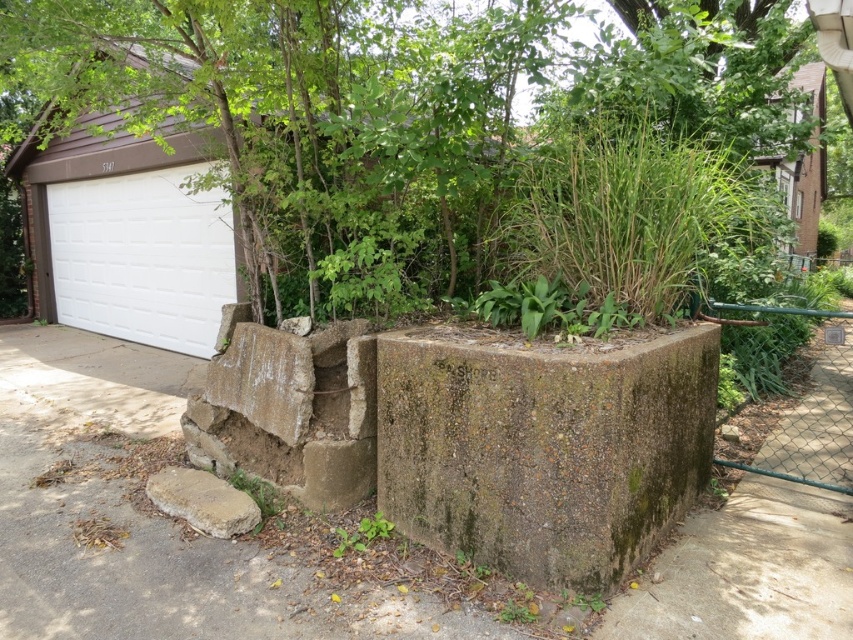
Is green chain-link fence at right taller than brown rough stone at lower left?

Incorrect, green chain-link fence at right's height is not larger of brown rough stone at lower left's.

Does green chain-link fence at right appear on the right side of brown rough stone at lower left?

Indeed, green chain-link fence at right is positioned on the right side of brown rough stone at lower left.

Is point (769, 460) positioned after point (178, 508)?

Yes, it is behind point (178, 508).

Locate an element on the screen. green chain-link fence at right is located at coordinates [x=799, y=413].

Between green leafy tree at center and green mossy concrete block at center, which one appears on the right side from the viewer's perspective?

Positioned to the right is green mossy concrete block at center.

Does green leafy tree at center have a lesser height compared to green mossy concrete block at center?

Yes, green leafy tree at center is shorter than green mossy concrete block at center.

Is point (648, 124) behind point (650, 364)?

That is True.

You are a GUI agent. You are given a task and a screenshot of the screen. Output one action in this format:
    pyautogui.click(x=<x>, y=<y>)
    Task: Click on the green leafy tree at center
    This screenshot has width=853, height=640.
    Given the screenshot: What is the action you would take?
    pyautogui.click(x=405, y=141)

Who is positioned more to the left, green chain-link fence at right or green leafy plant at lower center?

green leafy plant at lower center

From the picture: Who is shorter, green chain-link fence at right or green leafy plant at lower center?

green leafy plant at lower center

Is point (850, 465) farther from camera compared to point (369, 522)?

Yes, it is.

The height and width of the screenshot is (640, 853). In order to click on green chain-link fence at right in this screenshot , I will do `click(799, 413)`.